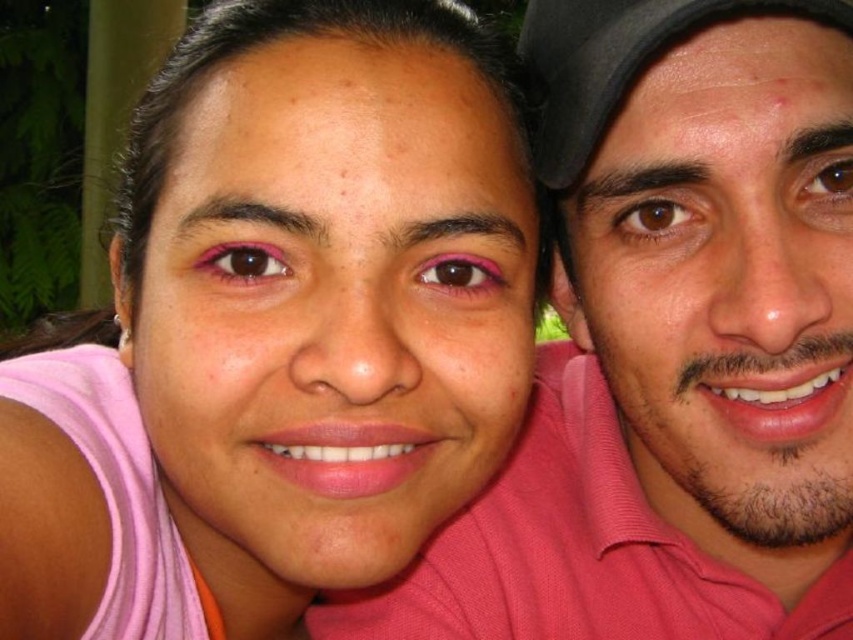
Question: Is pink matte skin at center above black fabric baseball cap at upper right?

Choices:
 (A) no
 (B) yes

Answer: (A)

Question: Which point is closer to the camera?

Choices:
 (A) pink matte shirt at right
 (B) pink matte skin at center

Answer: (B)

Question: Does pink matte shirt at right lie in front of pink cotton polo shirt at center?

Choices:
 (A) no
 (B) yes

Answer: (B)

Question: Which point is closer to the camera?

Choices:
 (A) (560, 20)
 (B) (630, 484)

Answer: (A)

Question: Which object is positioned closest to the pink matte skin at center?

Choices:
 (A) pink cotton polo shirt at center
 (B) black fabric baseball cap at upper right
 (C) pink matte shirt at right

Answer: (C)

Question: Is pink matte skin at center bigger than pink matte shirt at right?

Choices:
 (A) yes
 (B) no

Answer: (A)